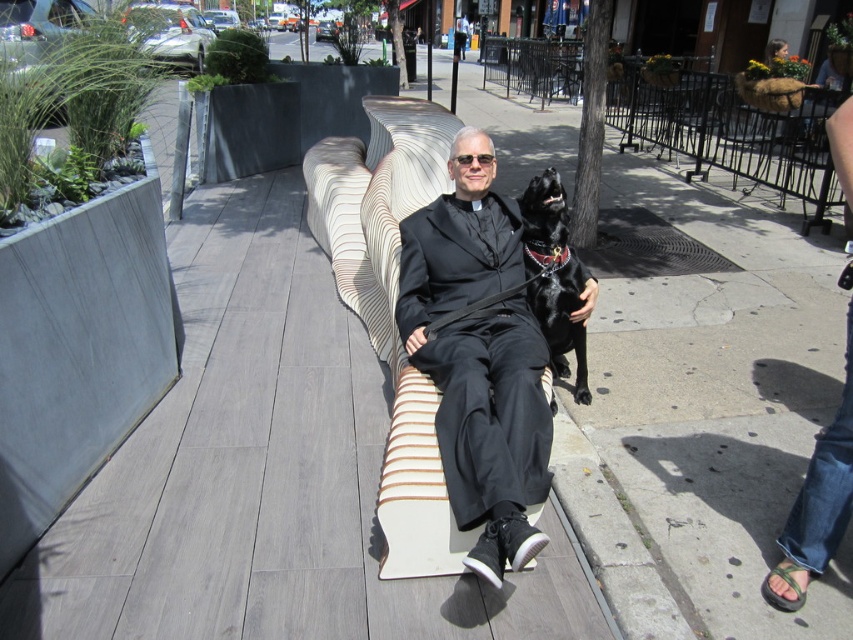
In the scene shown: You are a photographer trying to capture the black matte suit at center. The camera you are using has a focus point at coordinates point (x=479, y=356). Will the focus point align with the black matte suit at center?

The point (x=479, y=356) corresponds to the black matte suit at center, so yes, the focus point will align with the black matte suit at center.

You are standing at the camera position and want to throw a ball to a point that is 2 meters away from you. Is the point at coordinate point (x=532, y=326) within that range?

The distance of point (x=532, y=326) from camera is 2.54 meters, so the point is beyond the 2 meters range.

You are a photographer trying to capture a portrait of the black matte suit at center and the black leather dog at center. Since both are black, you want to ensure they are clearly separated in the photo. Based on their positions, which one should you focus on first to frame them properly?

The black matte suit at center is positioned on the left side of black leather dog at center. To frame them properly, focus on the black matte suit at center first as it is on the left, then ensure the black leather dog at center is on the right to distinguish their positions.